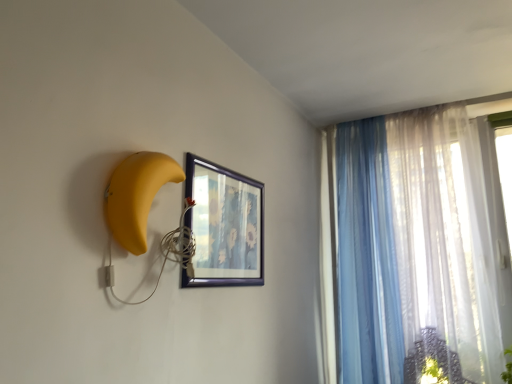
What is the approximate height of translucent fabric curtain at right, placed as the 1th curtain when sorted from right to left?

It is 1.54 meters.

The width and height of the screenshot is (512, 384). What do you see at coordinates (447, 234) in the screenshot?
I see `translucent fabric curtain at right, placed as the 1th curtain when sorted from right to left` at bounding box center [447, 234].

I want to click on wooden framed picture at center, so click(224, 225).

Find the location of a particular element. The width and height of the screenshot is (512, 384). translucent fabric curtain at right, placed as the 1th curtain when sorted from right to left is located at coordinates (447, 234).

Can you tell me how much yellow matte banana at left and wooden framed picture at center differ in facing direction?

There is a 0.00121-degree angle between the facing directions of yellow matte banana at left and wooden framed picture at center.

Is yellow matte banana at left positioned in front of wooden framed picture at center?

Yes, yellow matte banana at left is in front of wooden framed picture at center.

Would you say yellow matte banana at left is inside or outside wooden framed picture at center?

yellow matte banana at left is spatially situated outside wooden framed picture at center.

Which is behind, point (112, 222) or point (221, 199)?

The point (221, 199) is farther.

Is yellow matte banana at left taller or shorter than translucent fabric curtain at right, placed as the 1th curtain when sorted from right to left?

In the image, yellow matte banana at left appears to be shorter than translucent fabric curtain at right, placed as the 1th curtain when sorted from right to left.

Considering the relative positions of yellow matte banana at left and translucent fabric curtain at right, placed as the 1th curtain when sorted from right to left, in the image provided, is yellow matte banana at left to the left or to the right of translucent fabric curtain at right, placed as the 1th curtain when sorted from right to left,?

yellow matte banana at left is positioned on translucent fabric curtain at right, placed as the 1th curtain when sorted from right to left,'s left side.

Which is in front, yellow matte banana at left or translucent fabric curtain at right, which ranks as the 2th curtain in left-to-right order?

Positioned in front is yellow matte banana at left.

Is point (154, 186) farther from viewer compared to point (322, 172)?

No, (154, 186) is closer to viewer.

Who is taller, wooden framed picture at center or yellow matte banana at left?

wooden framed picture at center.

Is point (247, 184) less distant than point (163, 175)?

No, (247, 184) is behind (163, 175).

Considering the relative sizes of wooden framed picture at center and yellow matte banana at left in the image provided, is wooden framed picture at center smaller than yellow matte banana at left?

Actually, wooden framed picture at center might be larger than yellow matte banana at left.

Identify the location of banana that appears above the wooden framed picture at center (from a real-world perspective). (136, 196).

From the image's perspective, is yellow matte banana at left located above or below translucent blue curtain at upper right, the 1th curtain viewed from the left?

From the image's perspective, yellow matte banana at left appears above translucent blue curtain at upper right, the 1th curtain viewed from the left.

Consider the image. Is yellow matte banana at left directly adjacent to translucent blue curtain at upper right, the 1th curtain viewed from the left?

yellow matte banana at left and translucent blue curtain at upper right, the 1th curtain viewed from the left, are not in contact.

Image resolution: width=512 pixels, height=384 pixels. In order to click on banana above the translucent blue curtain at upper right, the 1th curtain viewed from the left (from the image's perspective) in this screenshot , I will do `click(136, 196)`.

Would you say yellow matte banana at left contains translucent blue curtain at upper right, the 1th curtain viewed from the left?

No, translucent blue curtain at upper right, the 1th curtain viewed from the left, is not a part of yellow matte banana at left.

Can you confirm if translucent fabric curtain at right, which ranks as the 2th curtain in left-to-right order, is positioned to the left of yellow matte banana at left?

Incorrect, translucent fabric curtain at right, which ranks as the 2th curtain in left-to-right order, is not on the left side of yellow matte banana at left.

Is point (399, 216) farther from camera compared to point (140, 170)?

Yes, it is.

Could you tell me if translucent fabric curtain at right, which ranks as the 2th curtain in left-to-right order, is turned towards yellow matte banana at left?

No, translucent fabric curtain at right, which ranks as the 2th curtain in left-to-right order, is not facing towards yellow matte banana at left.

Is translucent blue curtain at upper right, the 1th curtain viewed from the left, in front of or behind wooden framed picture at center in the image?

Visually, translucent blue curtain at upper right, the 1th curtain viewed from the left, is located behind wooden framed picture at center.

Is translucent blue curtain at upper right, the 1th curtain viewed from the left, oriented away from wooden framed picture at center?

No, translucent blue curtain at upper right, the 1th curtain viewed from the left,'s orientation is not away from wooden framed picture at center.

Does translucent blue curtain at upper right, acting as the 2th curtain starting from the right, have a lesser width compared to wooden framed picture at center?

In fact, translucent blue curtain at upper right, acting as the 2th curtain starting from the right, might be wider than wooden framed picture at center.

Is wooden framed picture at center positioned beyond the bounds of translucent blue curtain at upper right, acting as the 2th curtain starting from the right?

wooden framed picture at center lies outside translucent blue curtain at upper right, acting as the 2th curtain starting from the right,'s area.

Considering the relative sizes of wooden framed picture at center and translucent blue curtain at upper right, acting as the 2th curtain starting from the right, in the image provided, is wooden framed picture at center bigger than translucent blue curtain at upper right, acting as the 2th curtain starting from the right,?

No, wooden framed picture at center is not bigger than translucent blue curtain at upper right, acting as the 2th curtain starting from the right.

From a real-world perspective, which is physically above, wooden framed picture at center or translucent blue curtain at upper right, acting as the 2th curtain starting from the right?

From a 3D spatial view, wooden framed picture at center is above.

This screenshot has width=512, height=384. What are the coordinates of `banana that appears above the wooden framed picture at center (from the image's perspective)` in the screenshot? It's located at (136, 196).

Find the location of a particular element. This screenshot has width=512, height=384. the 1st curtain below the yellow matte banana at left (from the image's perspective) is located at coordinates (447, 234).

When comparing their distances from translucent fabric curtain at right, placed as the 1th curtain when sorted from right to left, does translucent blue curtain at upper right, the 1th curtain viewed from the left, or yellow matte banana at left seem closer?

translucent blue curtain at upper right, the 1th curtain viewed from the left, is closer to translucent fabric curtain at right, placed as the 1th curtain when sorted from right to left.

Considering their positions, is yellow matte banana at left positioned closer to translucent fabric curtain at right, which ranks as the 2th curtain in left-to-right order, than translucent blue curtain at upper right, the 1th curtain viewed from the left?

The object closer to translucent fabric curtain at right, which ranks as the 2th curtain in left-to-right order, is translucent blue curtain at upper right, the 1th curtain viewed from the left.

Considering their positions, is wooden framed picture at center positioned further to yellow matte banana at left than translucent fabric curtain at right, placed as the 1th curtain when sorted from right to left?

translucent fabric curtain at right, placed as the 1th curtain when sorted from right to left.

Which object lies further to the anchor point yellow matte banana at left, translucent fabric curtain at right, placed as the 1th curtain when sorted from right to left, or translucent blue curtain at upper right, acting as the 2th curtain starting from the right?

Among the two, translucent fabric curtain at right, placed as the 1th curtain when sorted from right to left, is located further to yellow matte banana at left.

Considering their positions, is translucent blue curtain at upper right, the 1th curtain viewed from the left, positioned closer to wooden framed picture at center than yellow matte banana at left?

Among the two, yellow matte banana at left is located nearer to wooden framed picture at center.

When comparing their distances from translucent blue curtain at upper right, acting as the 2th curtain starting from the right, does translucent fabric curtain at right, placed as the 1th curtain when sorted from right to left, or wooden framed picture at center seem further?

Among the two, wooden framed picture at center is located further to translucent blue curtain at upper right, acting as the 2th curtain starting from the right.

Considering their positions, is translucent fabric curtain at right, which ranks as the 2th curtain in left-to-right order, positioned further to yellow matte banana at left than wooden framed picture at center?

translucent fabric curtain at right, which ranks as the 2th curtain in left-to-right order, is positioned further to the anchor yellow matte banana at left.

From the image, which object appears to be farther from translucent blue curtain at upper right, acting as the 2th curtain starting from the right, yellow matte banana at left or translucent fabric curtain at right, which ranks as the 2th curtain in left-to-right order?

yellow matte banana at left lies further to translucent blue curtain at upper right, acting as the 2th curtain starting from the right, than the other object.

At what (x,y) coordinates should I click in order to perform the action: click on curtain between yellow matte banana at left and translucent fabric curtain at right, placed as the 1th curtain when sorted from right to left, in the horizontal direction. Please return your answer as a coordinate pair (x, y). Looking at the image, I should click on (367, 257).

Identify the location of picture frame located between yellow matte banana at left and translucent blue curtain at upper right, the 1th curtain viewed from the left, in the depth direction. (224, 225).

What are the coordinates of `picture frame between yellow matte banana at left and translucent fabric curtain at right, placed as the 1th curtain when sorted from right to left` in the screenshot? It's located at (224, 225).

What are the coordinates of `curtain between wooden framed picture at center and translucent fabric curtain at right, placed as the 1th curtain when sorted from right to left, in the horizontal direction` in the screenshot? It's located at (367, 257).